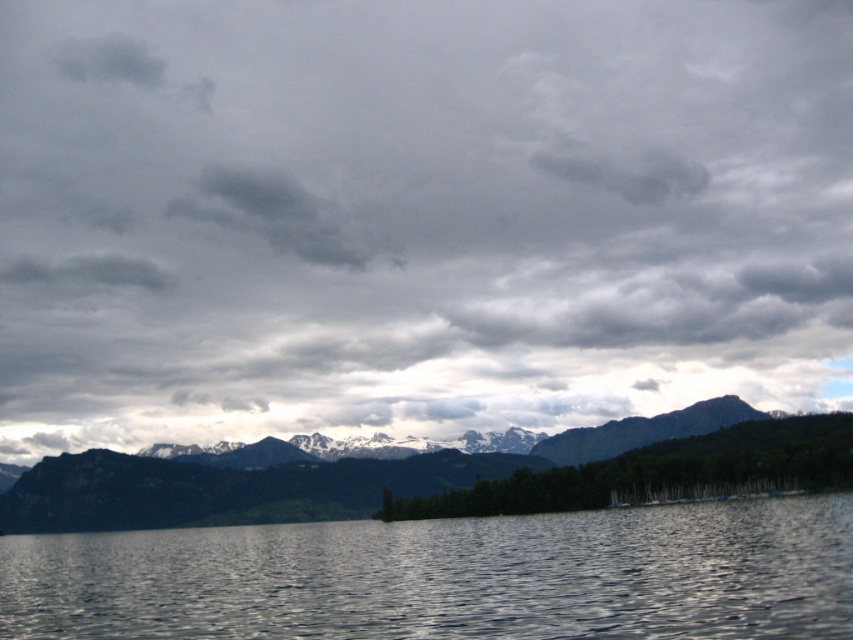
What do you see at coordinates (421, 214) in the screenshot? This screenshot has height=640, width=853. I see `cloudy sky at upper center` at bounding box center [421, 214].

Is cloudy sky at upper center positioned before dark gray cloud at upper center?

Yes, it is in front of dark gray cloud at upper center.

Is point (714, 51) behind point (328, 246)?

Yes.

This screenshot has height=640, width=853. Identify the location of cloudy sky at upper center. (421, 214).

Which of these two, dark gray cloud at upper center or gray fluffy cloud at upper center, stands shorter?

gray fluffy cloud at upper center is shorter.

In the scene shown: Can you confirm if dark gray cloud at upper center is positioned below gray fluffy cloud at upper center?

No.

Where is `dark gray cloud at upper center`? Image resolution: width=853 pixels, height=640 pixels. dark gray cloud at upper center is located at coordinates (280, 216).

Image resolution: width=853 pixels, height=640 pixels. I want to click on dark gray cloud at upper center, so click(x=280, y=216).

How distant is glistening water at lower left from snowy rock mountain range at center?

glistening water at lower left and snowy rock mountain range at center are 159.30 meters apart from each other.

Is glistening water at lower left bigger than snowy rock mountain range at center?

Yes.

This screenshot has height=640, width=853. What do you see at coordinates (450, 577) in the screenshot?
I see `glistening water at lower left` at bounding box center [450, 577].

Image resolution: width=853 pixels, height=640 pixels. What are the coordinates of `glistening water at lower left` in the screenshot? It's located at (450, 577).